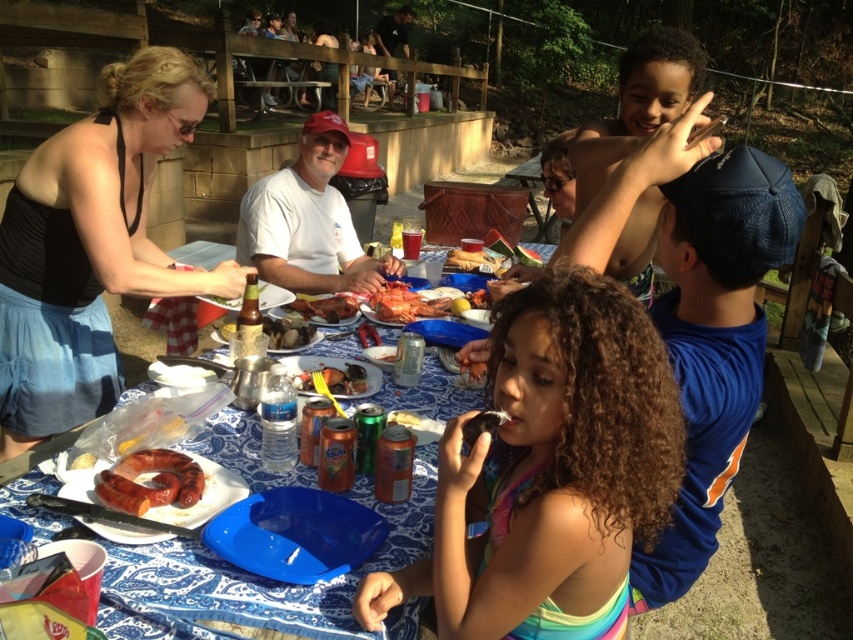
Is point (113, 497) closer to camera compared to point (370, 298)?

Yes, it is in front of point (370, 298).

Who is more forward, (184, 496) or (374, 310)?

Point (184, 496) is in front.

Where is `brown glossy sausage at lower left`? brown glossy sausage at lower left is located at coordinates (149, 481).

Does rainbow fabric dress at center lie in front of brown glossy sausage at lower left?

Yes, rainbow fabric dress at center is closer to the viewer.

Which is behind, point (555, 465) or point (163, 468)?

Point (163, 468)

Identify the location of rainbow fabric dress at center. Image resolution: width=853 pixels, height=640 pixels. (550, 472).

Find the location of a particular element. This screenshot has width=853, height=640. rainbow fabric dress at center is located at coordinates (550, 472).

This screenshot has height=640, width=853. I want to click on black fabric at left, so click(91, 246).

Is black fabric at left below brown glossy sausage at lower left?

Actually, black fabric at left is above brown glossy sausage at lower left.

Describe the element at coordinates (91, 246) in the screenshot. Image resolution: width=853 pixels, height=640 pixels. I see `black fabric at left` at that location.

The height and width of the screenshot is (640, 853). What are the coordinates of `black fabric at left` in the screenshot? It's located at (91, 246).